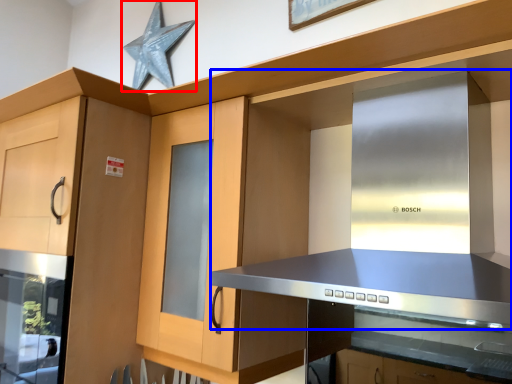
Question: Which of the following is the closest to the observer, star (highlighted by a red box) or vent (highlighted by a blue box)?

Choices:
 (A) star
 (B) vent

Answer: (B)